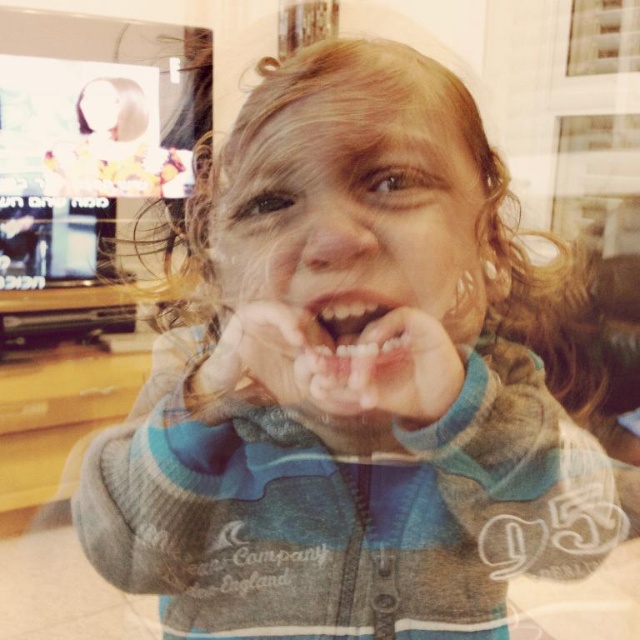
The image size is (640, 640). In order to click on matte skin hand at center in this screenshot , I will do [259, 353].

Who is more distant from viewer, (x=300, y=330) or (x=381, y=337)?

The point (x=300, y=330) is more distant.

At what (x,y) coordinates should I click in order to perform the action: click on matte skin hand at center. Please return your answer as a coordinate pair (x, y). The height and width of the screenshot is (640, 640). Looking at the image, I should click on (259, 353).

Between smooth skin face at center and white matte teeth at center, which one is positioned higher?

smooth skin face at center is higher up.

Based on the photo, which is below, smooth skin face at center or white matte teeth at center?

Positioned lower is white matte teeth at center.

In the scene shown: Who is more distant from viewer, (419, 412) or (413, 369)?

The point (419, 412) is behind.

The height and width of the screenshot is (640, 640). I want to click on smooth skin face at center, so click(x=349, y=260).

Which is more to the right, white matte teeth at center or smooth pink lips at center?

From the viewer's perspective, white matte teeth at center appears more on the right side.

Is white matte teeth at center positioned in front of smooth pink lips at center?

Yes.

Who is more forward, (340, 380) or (333, 349)?

Point (340, 380) is in front.

Locate an element on the screen. The width and height of the screenshot is (640, 640). white matte teeth at center is located at coordinates (385, 369).